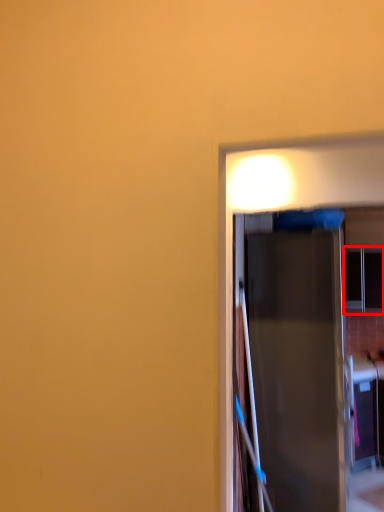
Question: From the image's perspective, where is window (annotated by the red box) located in relation to door in the image?

Choices:
 (A) below
 (B) above

Answer: (B)